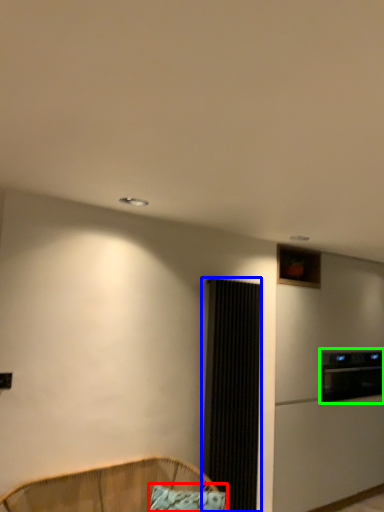
Question: Based on their relative distances, which object is nearer to pillow (highlighted by a red box)? Choose from screen door (highlighted by a blue box) and appliance (highlighted by a green box).

Choices:
 (A) screen door
 (B) appliance

Answer: (A)